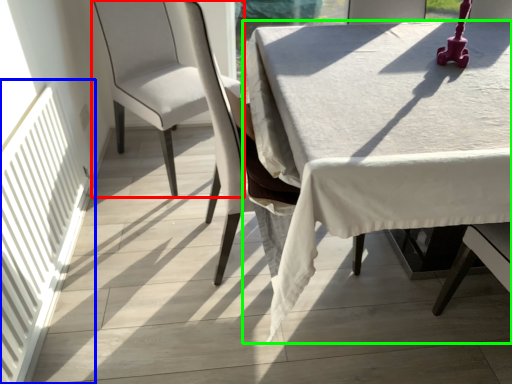
Question: Estimate the real-world distances between objects in this image. Which object is closer to chair (highlighted by a red box), radiator (highlighted by a blue box) or table (highlighted by a green box)?

Choices:
 (A) radiator
 (B) table

Answer: (A)